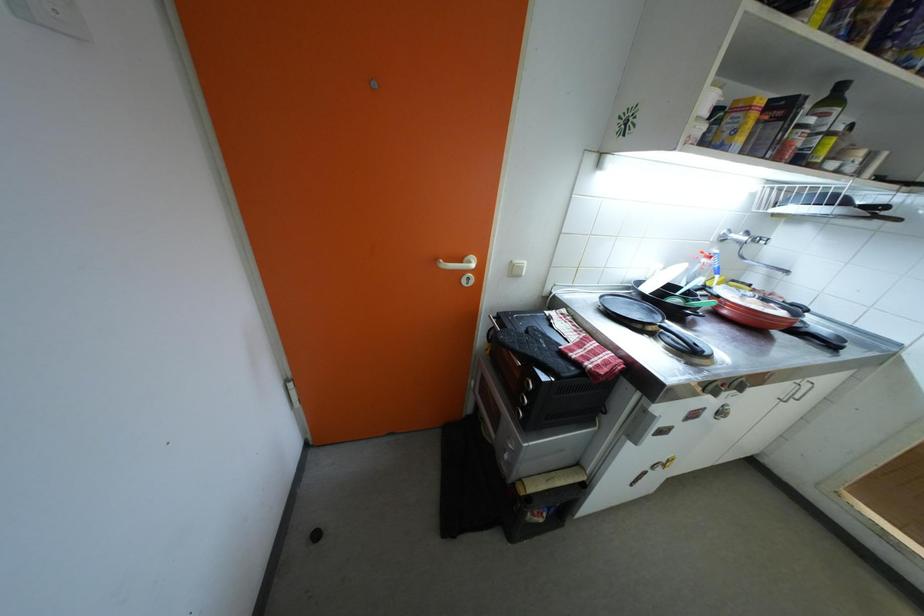
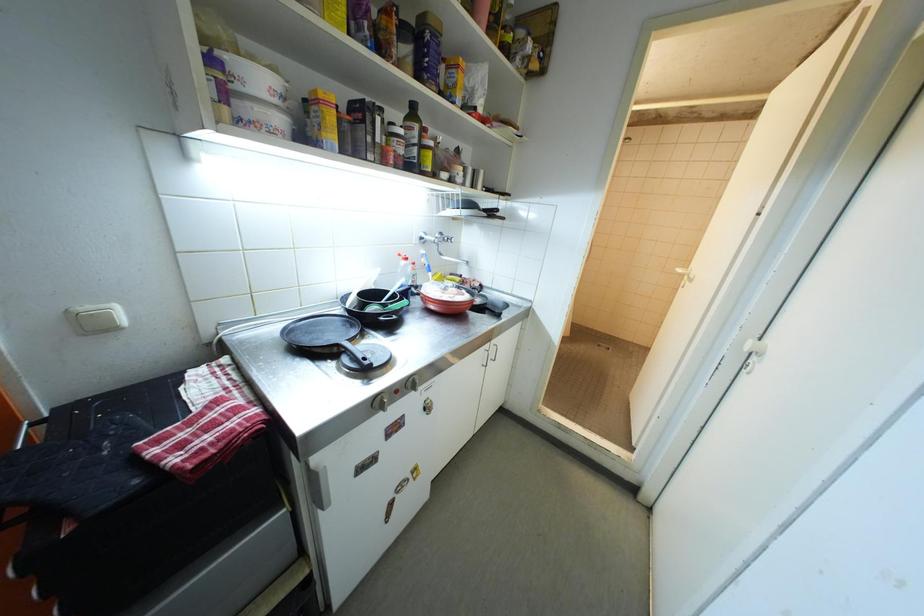
Question: Based on the continuous images, in which direction is the camera rotating? Reply with the corresponding letter.

Choices:
 (A) Left
 (B) Right
 (C) Up
 (D) Down

Answer: (B)